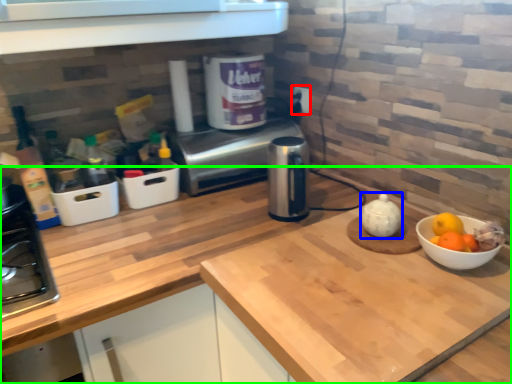
Question: Which object is the closest to the electric outlet (highlighted by a red box)? Choose among these: tea pot (highlighted by a blue box) or countertop (highlighted by a green box).

Choices:
 (A) tea pot
 (B) countertop

Answer: (A)